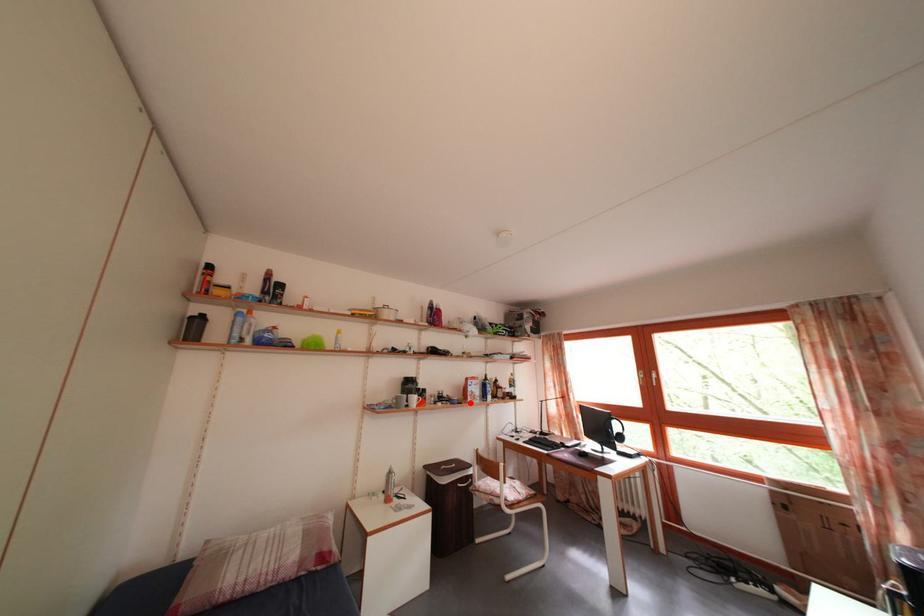
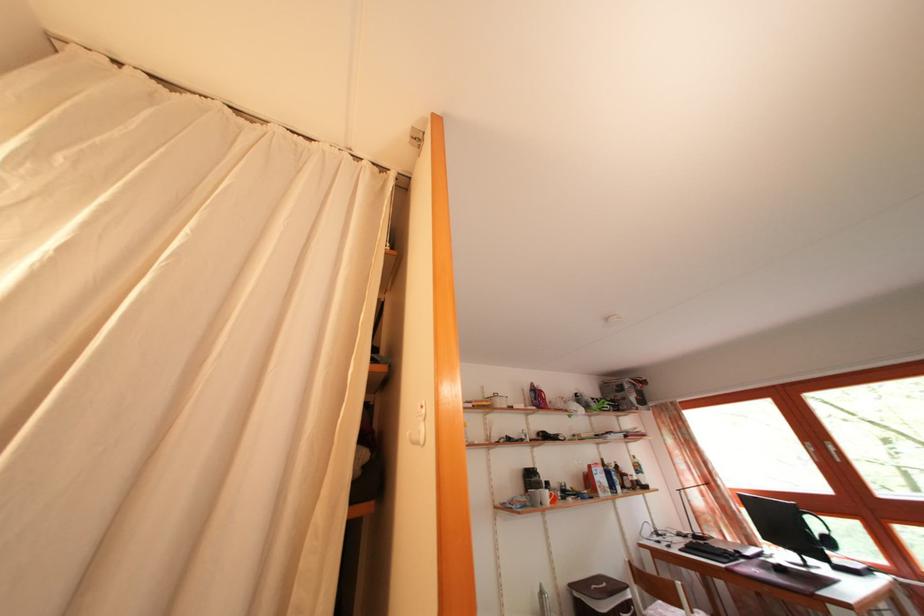
Where in the second image is the point corresponding to the highlighted location from the first image?

(593, 495)